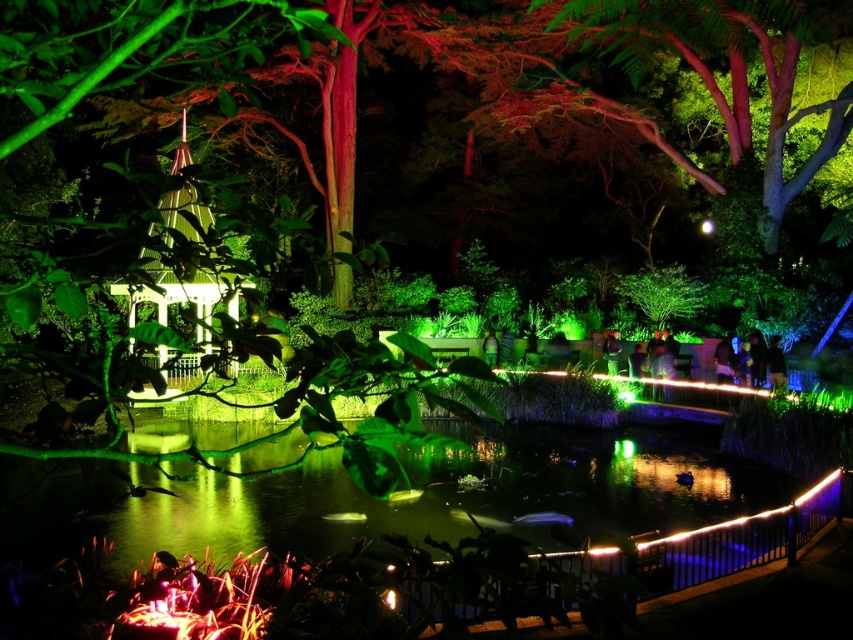
You are standing at the entrance of the botanical garden and see two points in the scene, point (451,422) and point (131,348). Which point is closer to you?

Point (451,422) is closer to the viewer than point (131,348).

You are planning to place a small decorative boat in the green reflective water at center. The boat requires a minimum width of 3 meters to avoid getting stuck near the white glossy gazebo at left. Can you determine if the water is wide enough based on the scene?

The green reflective water at center might be wider than white glossy gazebo at left, so there is a possibility that it meets the required width of 3 meters. However, without exact measurements, it is uncertain. Please verify the actual dimensions before placing the boat.